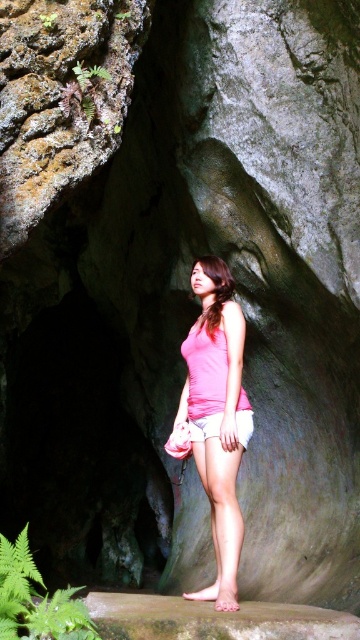
Can you confirm if pink fabric shorts at center is bigger than white cotton shorts at center?

Correct, pink fabric shorts at center is larger in size than white cotton shorts at center.

Where is `pink fabric shorts at center`? The height and width of the screenshot is (640, 360). pink fabric shorts at center is located at coordinates (217, 417).

The image size is (360, 640). Identify the location of pink fabric shorts at center. (217, 417).